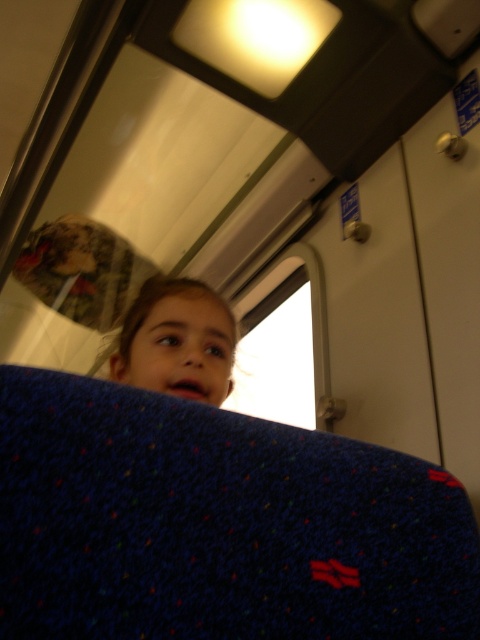
Question: Which point appears farthest from the camera in this image?

Choices:
 (A) (157, 368)
 (B) (264, 321)

Answer: (B)

Question: Can you confirm if transparent glass window at upper center is smaller than matte blue fabric at upper center?

Choices:
 (A) no
 (B) yes

Answer: (A)

Question: Does transparent glass window at upper center have a larger size compared to matte blue fabric at upper center?

Choices:
 (A) no
 (B) yes

Answer: (B)

Question: Which object appears farthest from the camera in this image?

Choices:
 (A) matte blue fabric at upper center
 (B) transparent glass window at upper center

Answer: (B)

Question: Considering the relative positions of transparent glass window at upper center and matte blue fabric at upper center in the image provided, where is transparent glass window at upper center located with respect to matte blue fabric at upper center?

Choices:
 (A) left
 (B) right

Answer: (B)